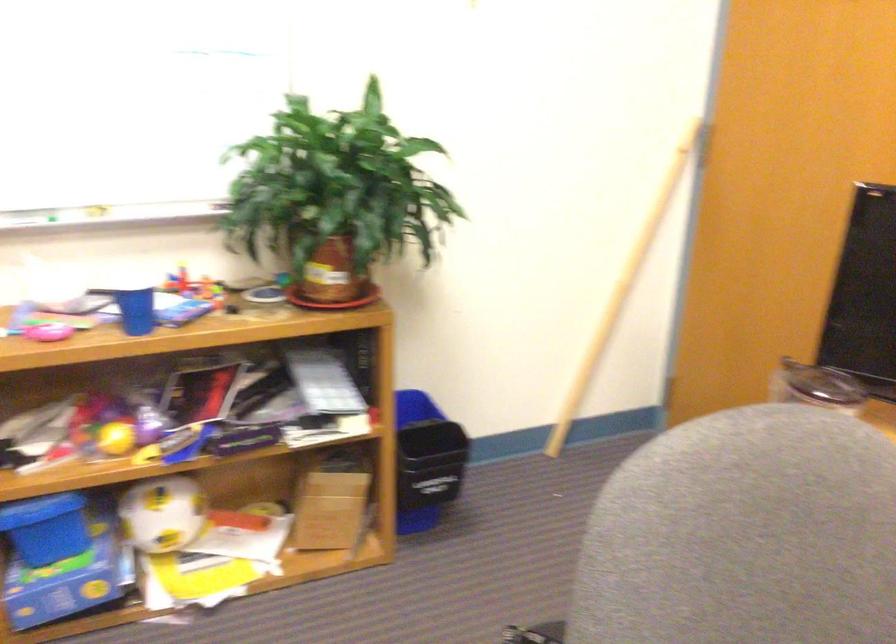
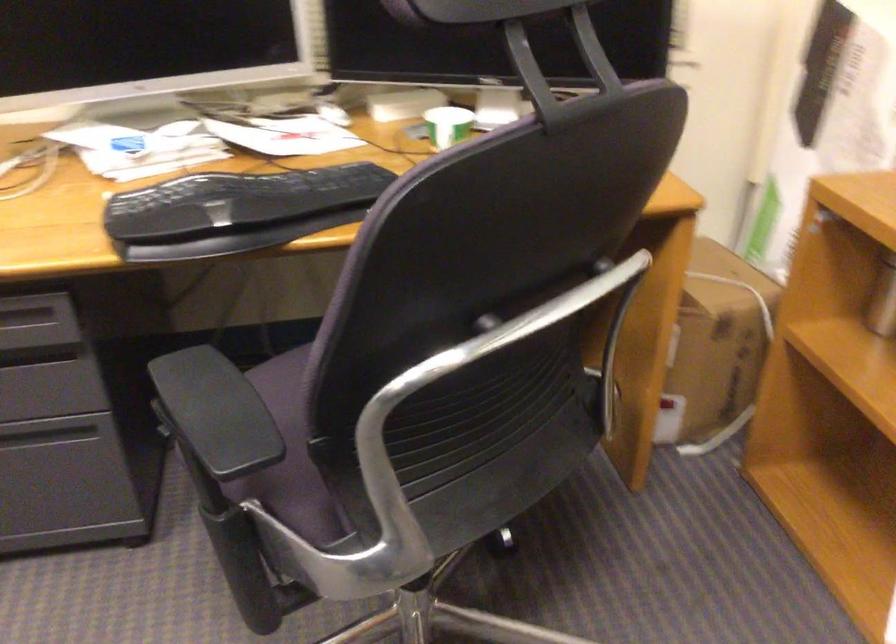
The first image is from the beginning of the video and the second image is from the end. How did the camera likely rotate when shooting the video?

The camera rotated toward left-down.